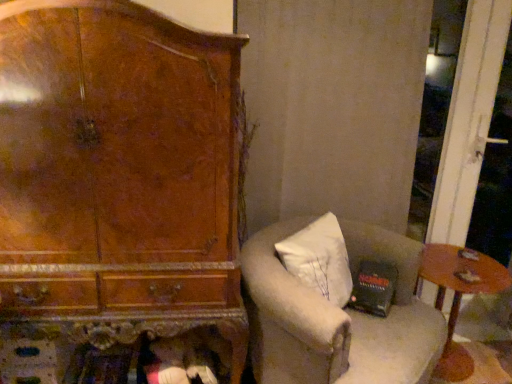
In order to face wooden round table at lower right, should I rotate leftwards or rightwards?

To face it directly, rotate right by 24.492 degrees.

Measure the distance between wooden round table at lower right and camera.

The distance of wooden round table at lower right from camera is 5.87 feet.

Image resolution: width=512 pixels, height=384 pixels. Describe the element at coordinates (459, 297) in the screenshot. I see `wooden round table at lower right` at that location.

You are a GUI agent. You are given a task and a screenshot of the screen. Output one action in this format:
    pyautogui.click(x=<x>, y=<y>)
    Task: Click on the wooden round table at lower right
    The height and width of the screenshot is (384, 512).
    Given the screenshot: What is the action you would take?
    pyautogui.click(x=459, y=297)

Describe the element at coordinates (337, 316) in the screenshot. I see `white fabric chair at center` at that location.

Identify the location of white fabric chair at center. tap(337, 316).

The image size is (512, 384). In order to click on wooden round table at lower right in this screenshot , I will do `click(459, 297)`.

Looking at this image, does white fabric chair at center appear on the left side of wooden round table at lower right?

Indeed, white fabric chair at center is positioned on the left side of wooden round table at lower right.

Is white fabric chair at center behind wooden round table at lower right?

No, it is not.

Considering the points (365, 241) and (482, 271), which point is in front, point (365, 241) or point (482, 271)?

Positioned in front is point (365, 241).

From the image's perspective, is white fabric chair at center located beneath wooden round table at lower right?

No, from the image's perspective, white fabric chair at center is not below wooden round table at lower right.

From a real-world perspective, relative to wooden round table at lower right, is white fabric chair at center vertically above or below?

From a real-world perspective, white fabric chair at center is physically above wooden round table at lower right.

Is white fabric chair at center wider or thinner than wooden round table at lower right?

Considering their sizes, white fabric chair at center looks broader than wooden round table at lower right.

Which of these two, white fabric chair at center or wooden round table at lower right, stands taller?

white fabric chair at center.

From the picture: Between white fabric chair at center and wooden round table at lower right, which one has larger size?

Bigger between the two is white fabric chair at center.

Is white fabric chair at center not inside wooden round table at lower right?

Yes, white fabric chair at center is located beyond the bounds of wooden round table at lower right.

Is white fabric chair at center not near wooden round table at lower right?

No, white fabric chair at center is not far from wooden round table at lower right.

Is wooden round table at lower right at the back of white fabric chair at center?

white fabric chair at center is not turned away from wooden round table at lower right.

Measure the distance from white fabric chair at center to wooden round table at lower right.

white fabric chair at center and wooden round table at lower right are 18.70 inches apart from each other.

Where is `table located underneath the white fabric chair at center (from a real-world perspective)`? This screenshot has height=384, width=512. table located underneath the white fabric chair at center (from a real-world perspective) is located at coordinates (459, 297).

Does wooden round table at lower right appear on the right side of white fabric chair at center?

Correct, you'll find wooden round table at lower right to the right of white fabric chair at center.

Is the position of wooden round table at lower right more distant than that of white fabric chair at center?

Yes, it is.

Is point (457, 367) closer or farther from the camera than point (255, 241)?

Point (457, 367).

From the image's perspective, which is above, wooden round table at lower right or white fabric chair at center?

From the image's view, white fabric chair at center is above.

From a real-world perspective, is wooden round table at lower right on white fabric chair at center?

No.

Does wooden round table at lower right have a lesser width compared to white fabric chair at center?

Yes, wooden round table at lower right is thinner than white fabric chair at center.

Considering the relative sizes of wooden round table at lower right and white fabric chair at center in the image provided, is wooden round table at lower right taller than white fabric chair at center?

Incorrect, the height of wooden round table at lower right is not larger of that of white fabric chair at center.

Does wooden round table at lower right have a larger size compared to white fabric chair at center?

No.

Do you think wooden round table at lower right is within white fabric chair at center, or outside of it?

wooden round table at lower right is spatially situated outside white fabric chair at center.

From the picture: Is wooden round table at lower right placed right next to white fabric chair at center?

wooden round table at lower right and white fabric chair at center are not in contact.

Is wooden round table at lower right positioned with its back to white fabric chair at center?

wooden round table at lower right does not have its back to white fabric chair at center.

What's the angular difference between wooden round table at lower right and white fabric chair at center's facing directions?

They differ by 39.5 degrees in their facing directions.

This screenshot has width=512, height=384. Identify the location of chair on the left of wooden round table at lower right. (337, 316).

Identify the location of chair on the left side of wooden round table at lower right. This screenshot has height=384, width=512. (337, 316).

Where is `table that is below the white fabric chair at center (from the image's perspective)`? Image resolution: width=512 pixels, height=384 pixels. table that is below the white fabric chair at center (from the image's perspective) is located at coordinates (459, 297).